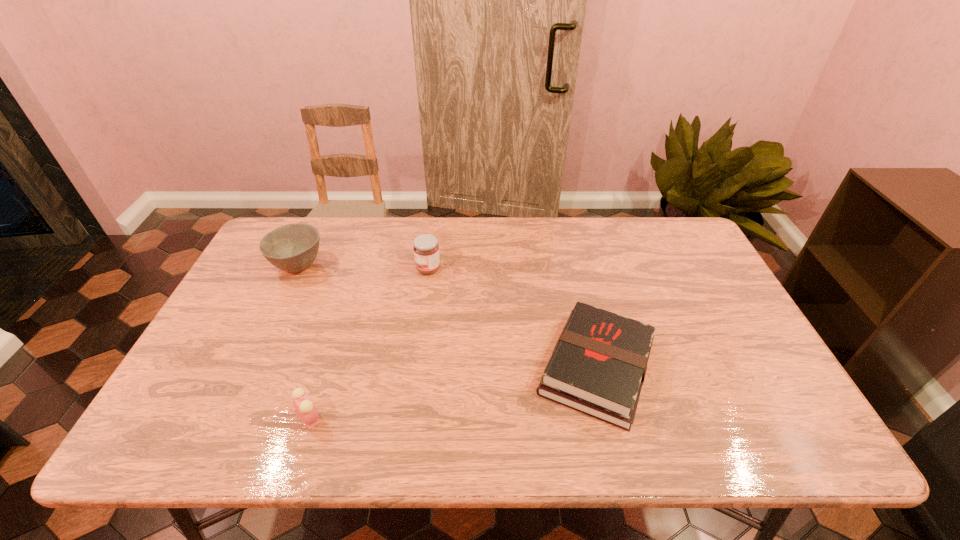
Where is `jam`? The height and width of the screenshot is (540, 960). jam is located at coordinates (426, 248).

Image resolution: width=960 pixels, height=540 pixels. In order to click on the leftmost object in this screenshot , I will do `click(293, 247)`.

Where is `alarm clock`? The image size is (960, 540). alarm clock is located at coordinates (305, 409).

At what (x,y) coordinates should I click in order to perform the action: click on hardback book. Please return your answer as a coordinate pair (x, y). Looking at the image, I should click on (598, 366).

At what (x,y) coordinates should I click in order to perform the action: click on vacant region located 0.060m on the right of the jam. Please return your answer as a coordinate pair (x, y). Looking at the image, I should click on (460, 269).

I want to click on vacant space located 0.300m on the front of the bowl, so click(251, 366).

The width and height of the screenshot is (960, 540). I want to click on free space located 0.120m on the face of the alarm clock, so click(x=377, y=418).

This screenshot has width=960, height=540. In order to click on vacant region located on the back of the rightmost object in this screenshot , I will do `click(571, 264)`.

This screenshot has height=540, width=960. Find the location of `object that is at the far edge`. object that is at the far edge is located at coordinates (293, 247).

The width and height of the screenshot is (960, 540). Find the location of `alarm clock that is positioned at the near edge`. alarm clock that is positioned at the near edge is located at coordinates (305, 409).